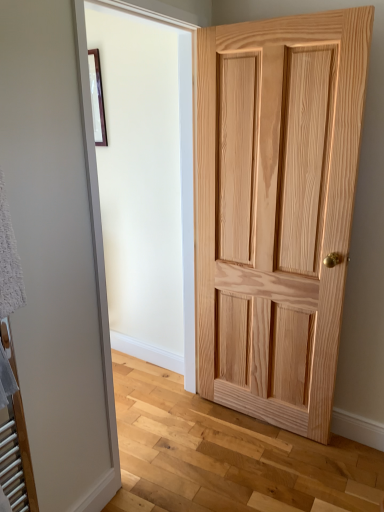
You are a GUI agent. You are given a task and a screenshot of the screen. Output one action in this format:
    pyautogui.click(x=<x>, y=<y>)
    Task: Click on the vacant space in natural wood door at right (from a real-world perspective)
    This screenshot has width=384, height=512.
    Given the screenshot: What is the action you would take?
    pyautogui.click(x=254, y=422)